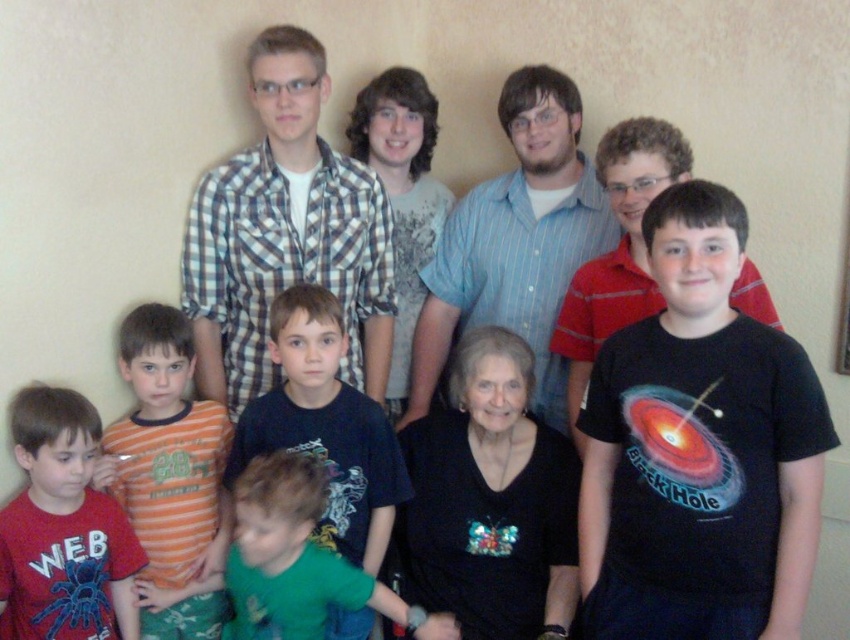
Question: Which point appears farthest from the camera in this image?

Choices:
 (A) (x=324, y=417)
 (B) (x=183, y=422)
 (C) (x=777, y=451)
 (D) (x=314, y=282)

Answer: (D)

Question: Is checkered fabric shirt at upper center positioned at the back of dark blue t-shirt at center?

Choices:
 (A) no
 (B) yes

Answer: (B)

Question: Estimate the real-world distances between objects in this image. Which object is farther from the dark blue t-shirt at center?

Choices:
 (A) checkered fabric shirt at upper center
 (B) black matte t-shirt at center

Answer: (B)

Question: Estimate the real-world distances between objects in this image. Which object is closer to the dark blue t-shirt at center?

Choices:
 (A) orange cotton shirt at lower left
 (B) black matte t-shirt at center
 (C) matte red t-shirt at lower left

Answer: (A)

Question: Does black matte t-shirt at center have a smaller size compared to checkered fabric shirt at upper center?

Choices:
 (A) no
 (B) yes

Answer: (B)

Question: Is dark blue t-shirt at center to the left of green fabric shirt at lower center from the viewer's perspective?

Choices:
 (A) no
 (B) yes

Answer: (A)